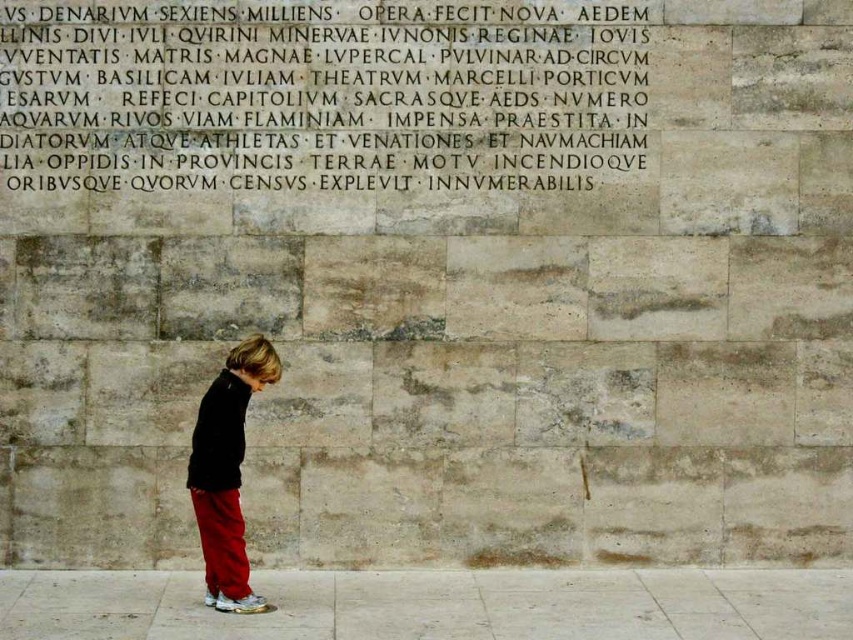
You are a tour guide explaining the historical site to a group. You need to direct visitors to the stone inscription at upper center. Based on the child in the image, where should visitors look relative to the child?

The stone inscription at upper center is located above the child, so visitors should look upwards from the child to find it.

You are an architect designing a new museum exhibit. You need to ensure that visitors can comfortably view both the stone inscription at upper center and the matte black jacket at center displayed in the scene. Given their sizes, which object should be placed on a higher platform to ensure both are at eye level for most adults?

The stone inscription at upper center should be placed on a higher platform because it has a lesser height compared to the matte black jacket at center, so elevating it would help both reach eye level for most adults.